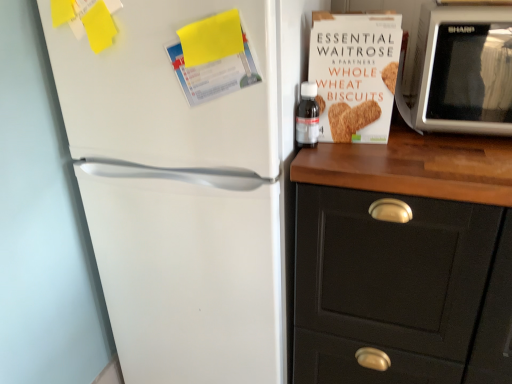
You are a GUI agent. You are given a task and a screenshot of the screen. Output one action in this format:
    pyautogui.click(x=<x>, y=<y>)
    Task: Click on the free space in front of white cardboard box of whole wheat biscuits at upper right
    Image resolution: width=512 pixels, height=384 pixels.
    Given the screenshot: What is the action you would take?
    pyautogui.click(x=370, y=164)